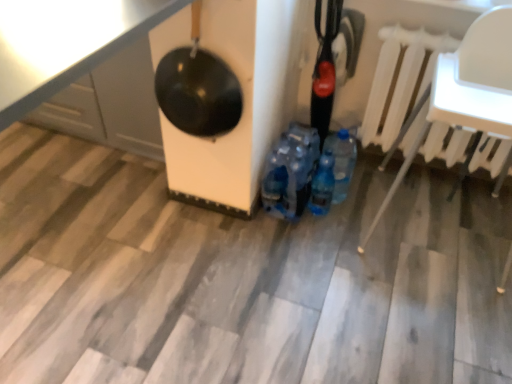
Locate an element on the screen. This screenshot has height=384, width=512. free space in front of shiny black pan at upper left is located at coordinates (73, 220).